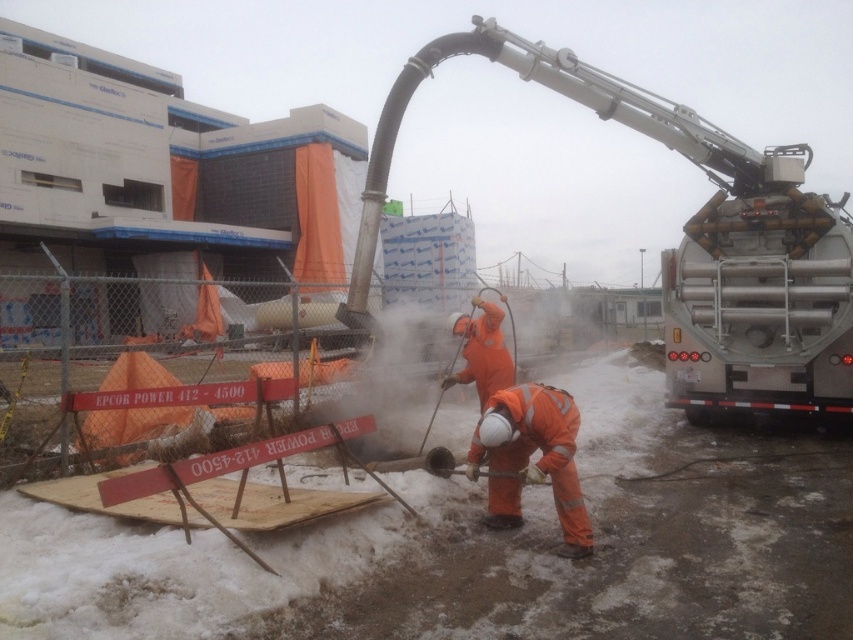
You are a delivery driver who needs to park your 2.5 meter tall truck near the construction site. The construction site has a silver metallic truck at right and orange reflective workwear at lower center. Which object should you avoid parking near to ensure your truck doesn

The silver metallic truck at right is taller than orange reflective workwear at lower center. Since your truck is 2.5 meters tall, you should avoid parking near the silver metallic truck at right to prevent potential height restrictions or obstructions caused by its height.

You are a safety inspector at the construction site. You need to check the safety distance between the silver metallic truck at right and the orange reflective workwear at lower center. According to the safety regulations, the minimum distance between heavy machinery and workers should be 2 meters. Can you determine if the current setup complies with the safety regulations?

The silver metallic truck at right is located above orange reflective workwear at lower center, but the vertical distance between them is not specified. Safety regulations require a horizontal distance of at least 2 meters between heavy machinery and workers. Since the description only mentions their vertical positioning, we cannot confirm compliance with the safety regulations based on the provided information.